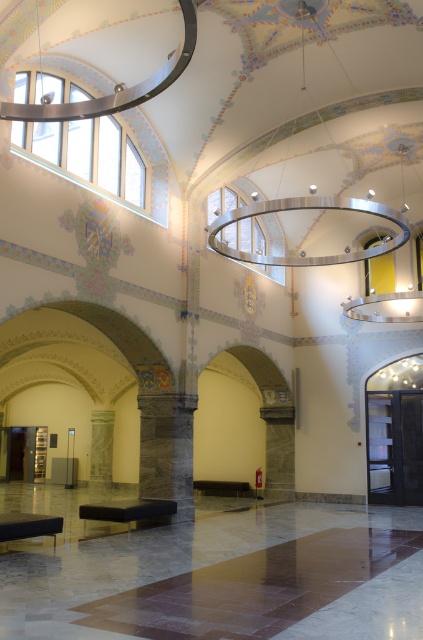
Question: Can you confirm if matte black door at right is positioned above marble pillar at center?

Choices:
 (A) yes
 (B) no

Answer: (A)

Question: Which point appears closest to the camera in this image?

Choices:
 (A) (386, 412)
 (B) (93, 481)

Answer: (A)

Question: Which object appears farthest from the camera in this image?

Choices:
 (A) marble pillar at center
 (B) matte black door at right

Answer: (A)

Question: Can you confirm if matte black door at right is positioned below marble pillar at center?

Choices:
 (A) yes
 (B) no

Answer: (B)

Question: Which of the following is the farthest from the observer?

Choices:
 (A) (102, 449)
 (B) (392, 428)

Answer: (A)

Question: Is matte black door at right thinner than marble pillar at center?

Choices:
 (A) yes
 (B) no

Answer: (B)